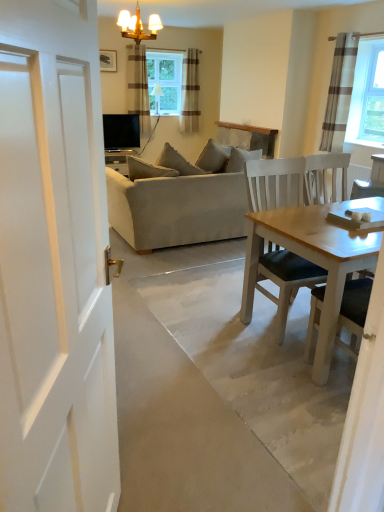
Question: Which direction should I rotate to look at beige striped curtain at upper center, the first curtain from the back, — up or down?

Choices:
 (A) down
 (B) up

Answer: (B)

Question: From the image's perspective, is beige fabric couch at center located beneath beige striped curtain at upper center, marked as the third curtain in a front-to-back arrangement?

Choices:
 (A) yes
 (B) no

Answer: (A)

Question: Is beige fabric couch at center outside of beige striped curtain at upper center, arranged as the 2th curtain when viewed from the right?

Choices:
 (A) yes
 (B) no

Answer: (A)

Question: Considering the relative positions of beige fabric couch at center and beige striped curtain at upper center, arranged as the 2th curtain when viewed from the right, in the image provided, is beige fabric couch at center to the left of beige striped curtain at upper center, arranged as the 2th curtain when viewed from the right, from the viewer's perspective?

Choices:
 (A) yes
 (B) no

Answer: (B)

Question: From a real-world perspective, is beige fabric couch at center on beige striped curtain at upper center, arranged as the second curtain when viewed from the left?

Choices:
 (A) no
 (B) yes

Answer: (A)

Question: Considering the relative sizes of beige fabric couch at center and beige striped curtain at upper center, arranged as the 2th curtain when viewed from the right, in the image provided, is beige fabric couch at center wider than beige striped curtain at upper center, arranged as the 2th curtain when viewed from the right,?

Choices:
 (A) no
 (B) yes

Answer: (B)

Question: Considering the relative positions of beige fabric couch at center and beige striped curtain at upper center, marked as the third curtain in a front-to-back arrangement, in the image provided, is beige fabric couch at center to the right of beige striped curtain at upper center, marked as the third curtain in a front-to-back arrangement, from the viewer's perspective?

Choices:
 (A) yes
 (B) no

Answer: (A)

Question: Can you confirm if gray striped curtain at upper right, which appears as the 3th curtain when viewed from the left, is bigger than sheer brown striped curtain at upper center, placed as the 1th curtain when sorted from left to right?

Choices:
 (A) yes
 (B) no

Answer: (B)

Question: From a real-world perspective, is gray striped curtain at upper right, acting as the third curtain starting from the back, physically below sheer brown striped curtain at upper center, which appears as the second curtain when viewed from the front?

Choices:
 (A) no
 (B) yes

Answer: (A)

Question: Is gray striped curtain at upper right, which appears as the 3th curtain when viewed from the left, positioned before sheer brown striped curtain at upper center, placed as the 1th curtain when sorted from left to right?

Choices:
 (A) yes
 (B) no

Answer: (A)

Question: Does gray striped curtain at upper right, which appears as the 3th curtain when viewed from the left, appear on the right side of sheer brown striped curtain at upper center, placed as the 1th curtain when sorted from left to right?

Choices:
 (A) yes
 (B) no

Answer: (A)

Question: Is the surface of gray striped curtain at upper right, acting as the 1th curtain starting from the front, in direct contact with sheer brown striped curtain at upper center, placed as the second curtain when sorted from back to front?

Choices:
 (A) no
 (B) yes

Answer: (A)

Question: Is gray striped curtain at upper right, acting as the third curtain starting from the back, taller than sheer brown striped curtain at upper center, which appears as the second curtain when viewed from the front?

Choices:
 (A) no
 (B) yes

Answer: (B)

Question: From a real-world perspective, is gold metallic chandelier at upper center beneath sheer brown striped curtain at upper center, which appears as the second curtain when viewed from the front?

Choices:
 (A) no
 (B) yes

Answer: (A)